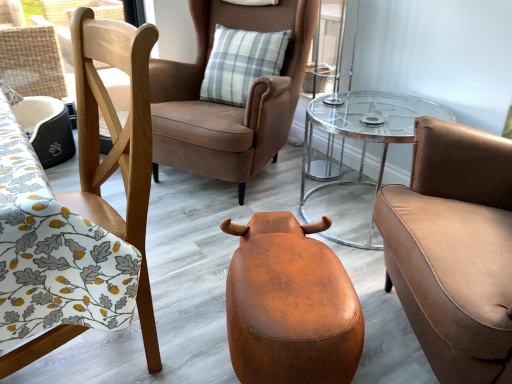
Question: From a real-world perspective, relative to brown leather chair at center, positioned as the second chair in left-to-right order, is leather ottoman at center vertically above or below?

Choices:
 (A) above
 (B) below

Answer: (B)

Question: Is leather ottoman at center to the left or to the right of brown leather chair at center, marked as the 2th chair in a right-to-left arrangement, in the image?

Choices:
 (A) right
 (B) left

Answer: (A)

Question: Which object is positioned closest to the wooden chair at left, acting as the first chair starting from the left?

Choices:
 (A) brown leather chair at center, positioned as the second chair in left-to-right order
 (B) clear glass table at center
 (C) matte brown leather armchair at right, positioned as the 3th chair in left-to-right order
 (D) leather ottoman at center

Answer: (D)

Question: Which object is positioned farthest from the matte brown leather armchair at right, positioned as the 3th chair in left-to-right order?

Choices:
 (A) leather ottoman at center
 (B) wooden chair at left, acting as the first chair starting from the left
 (C) clear glass table at center
 (D) brown leather chair at center, marked as the 2th chair in a right-to-left arrangement

Answer: (D)